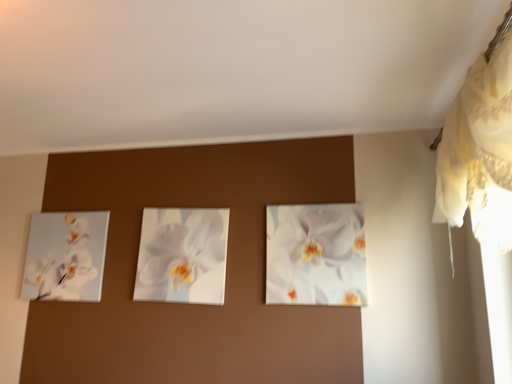
Question: Considering the positions of white glossy orchid at center, which appears as the 2th flower when viewed from the left, and white glossy orchid at center, marked as the 2th flower in a right-to-left arrangement, in the image, is white glossy orchid at center, which appears as the 2th flower when viewed from the left, wider or thinner than white glossy orchid at center, marked as the 2th flower in a right-to-left arrangement,?

Choices:
 (A) thin
 (B) wide

Answer: (B)

Question: In the image, is white glossy orchid at center, which is counted as the first flower, starting from the right, positioned in front of or behind white glossy orchid at center, which appears as the first flower when viewed from the left?

Choices:
 (A) behind
 (B) front

Answer: (B)

Question: Estimate the real-world distances between objects in this image. Which object is closer to the white lace curtain at upper right?

Choices:
 (A) white glossy orchid at center, marked as the 2th flower in a right-to-left arrangement
 (B) white glossy orchid at center, which is counted as the first flower, starting from the right
 (C) white glossy orchid painting at left

Answer: (B)

Question: Based on their relative distances, which object is farther from the white glossy orchid painting at left?

Choices:
 (A) white glossy orchid at center, marked as the 2th flower in a right-to-left arrangement
 (B) white lace curtain at upper right
 (C) white glossy orchid at center, which appears as the 2th flower when viewed from the left

Answer: (B)